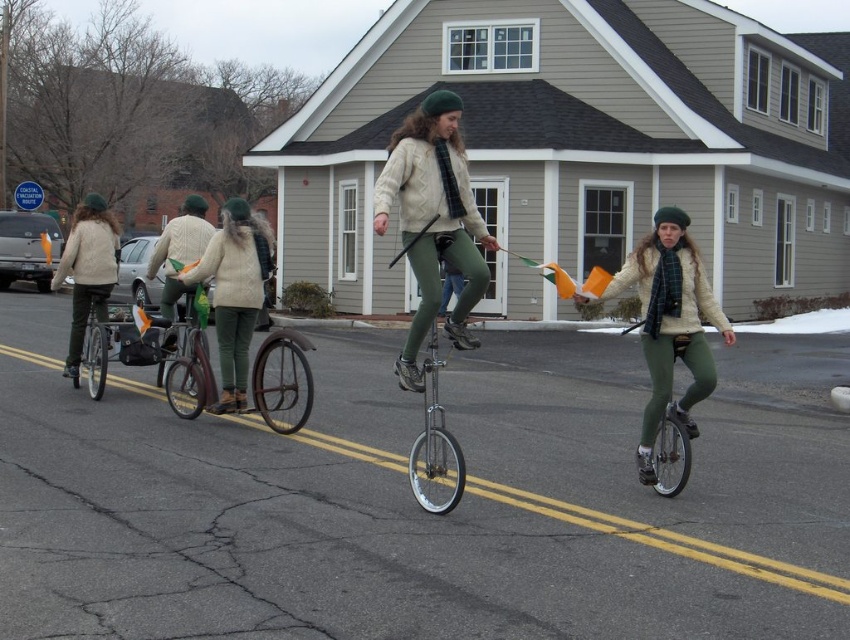
You are a pedestrian standing on the sidewalk and see the brown leather bicycle at center and the shiny silver unicycle at center. Which one is closer to the left side of the road?

The brown leather bicycle at center is closer to the left side of the road because it is positioned to the left of the shiny silver unicycle at center.

You are a pedestrian standing on the sidewalk and see the matte white sweater at left and the silver metallic unicycle at center. Which object is closer to you?

The matte white sweater at left is closer to you because the silver metallic unicycle at center is behind it.

You are a delivery person who needs to choose between the brown leather bicycle at center and the shiny silver unicycle at center for a quick delivery in the snowy area. Which one would you choose and why?

You should choose the brown leather bicycle at center because it is taller than the shiny silver unicycle at center, providing better stability and control on the snowy terrain.